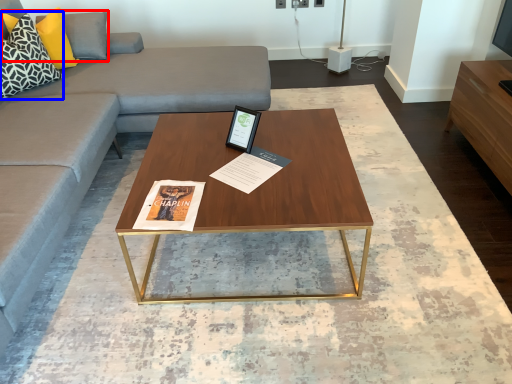
Question: Which object appears farthest to the camera in this image, pillow (highlighted by a red box) or pillow (highlighted by a blue box)?

Choices:
 (A) pillow
 (B) pillow

Answer: (A)